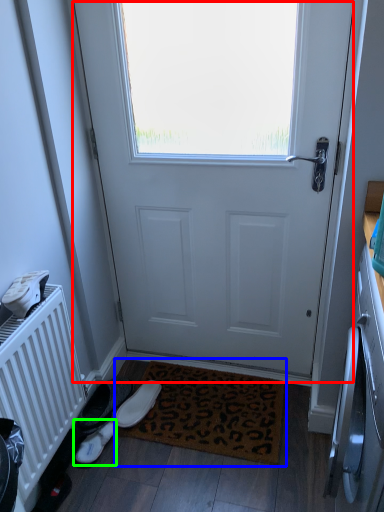
Question: Which object is positioned farthest from door (highlighted by a red box)? Select from doormat (highlighted by a blue box) and footwear (highlighted by a green box).

Choices:
 (A) doormat
 (B) footwear

Answer: (B)